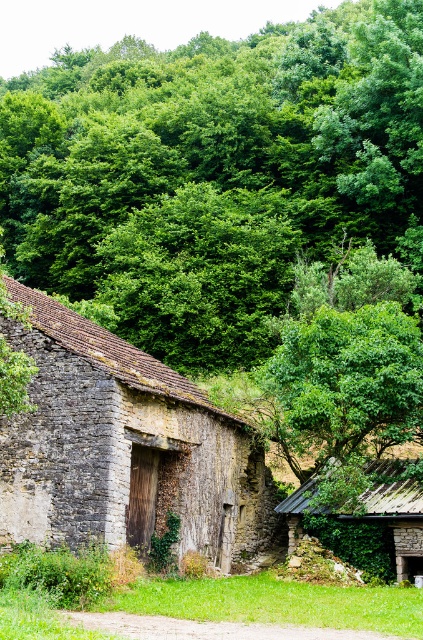
Question: Which point appears farthest from the camera in this image?

Choices:
 (A) (246, 205)
 (B) (18, 323)

Answer: (A)

Question: Can you confirm if stone textured hut at left is positioned to the left of rusty metal hut at center?

Choices:
 (A) yes
 (B) no

Answer: (A)

Question: Considering the real-world distances, which object is closest to the rusty metal hut at center?

Choices:
 (A) stone textured hut at left
 (B) green leafy tree at upper center

Answer: (A)

Question: Can you confirm if green leafy tree at upper center is positioned to the right of rusty metal hut at center?

Choices:
 (A) yes
 (B) no

Answer: (B)

Question: Is green leafy tree at upper center closer to the viewer compared to stone textured hut at left?

Choices:
 (A) yes
 (B) no

Answer: (B)

Question: Which point is closer to the camera?

Choices:
 (A) (208, 368)
 (B) (38, 508)
 (C) (379, 474)

Answer: (B)